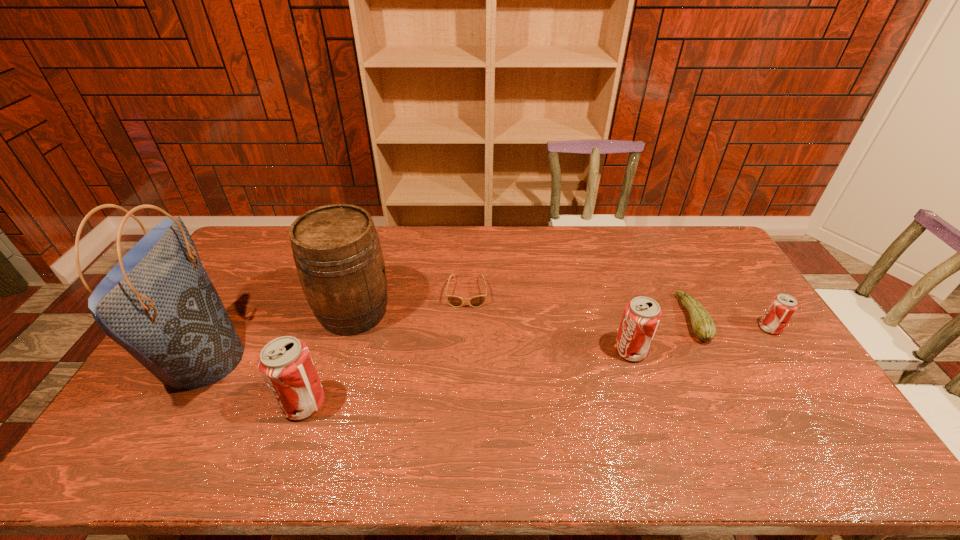
I want to click on free spot between the fifth tallest object and the shortest object, so click(618, 310).

Locate which object is the third closest to the sixth object from left to right. Please provide its 2D coordinates. Your answer should be formatted as a tuple, i.e. [(x, y)], where the tuple contains the x and y coordinates of a point satisfying the conditions above.

[(455, 301)]

Identify the location of object that is the second nearest to the tallest object. (285, 363).

You are a GUI agent. You are given a task and a screenshot of the screen. Output one action in this format:
    pyautogui.click(x=<x>, y=<y>)
    Task: Click on the soda can object that ranks as the second closest to the sunglasses
    Image resolution: width=960 pixels, height=540 pixels.
    Given the screenshot: What is the action you would take?
    pos(285,363)

Identify which soda can is the third closest to the leftmost object. Please provide its 2D coordinates. Your answer should be formatted as a tuple, i.e. [(x, y)], where the tuple contains the x and y coordinates of a point satisfying the conditions above.

[(782, 307)]

I want to click on vacant area that satisfies the following two spatial constraints: 1. on the back side of the third object from right to left; 2. on the left side of the shopping bag, so click(208, 350).

This screenshot has width=960, height=540. I want to click on vacant point that satisfies the following two spatial constraints: 1. on the side of the second tallest object near the bung hole; 2. on the left side of the fifth object from left to right, so click(x=342, y=350).

I want to click on free space that satisfies the following two spatial constraints: 1. at the stem end of the zucchini; 2. on the back side of the farthest soda can, so click(x=698, y=328).

Locate an element on the screen. This screenshot has width=960, height=540. free point that satisfies the following two spatial constraints: 1. on the back side of the rightmost soda can; 2. on the side of the cider near the bung hole is located at coordinates (758, 312).

You are a GUI agent. You are given a task and a screenshot of the screen. Output one action in this format:
    pyautogui.click(x=<x>, y=<y>)
    Task: Click on the free spot that satisfies the following two spatial constraints: 1. on the front-facing side of the shortest object; 2. on the right side of the second soda can from left to right
    The height and width of the screenshot is (540, 960).
    Given the screenshot: What is the action you would take?
    pyautogui.click(x=465, y=350)